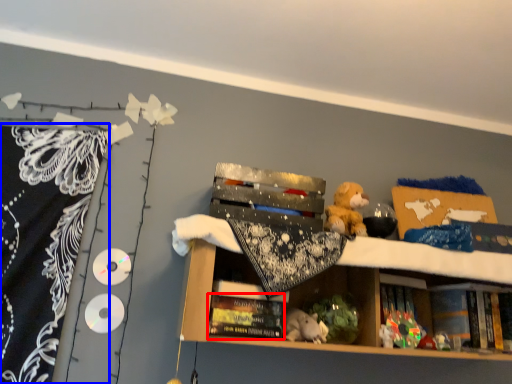
Question: Which object is further to the camera taking this photo, book (highlighted by a red box) or blanket (highlighted by a blue box)?

Choices:
 (A) book
 (B) blanket

Answer: (B)